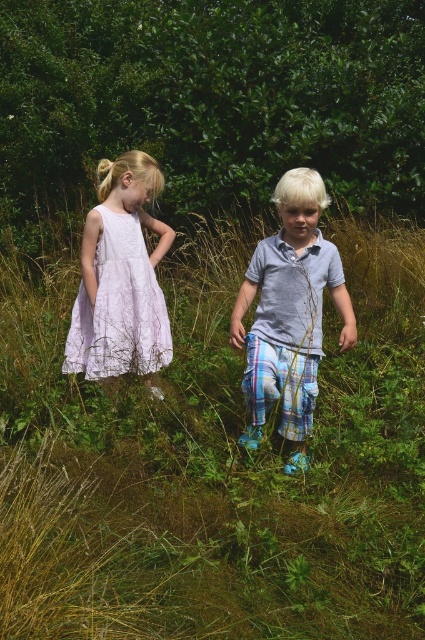
Is light blue plaid pants at center further to the viewer compared to lavender lace dress at left?

No.

Who is positioned more to the left, light blue plaid pants at center or lavender lace dress at left?

Positioned to the left is lavender lace dress at left.

Is point (282, 365) positioned in front of point (155, 296)?

Yes.

You are a GUI agent. You are given a task and a screenshot of the screen. Output one action in this format:
    pyautogui.click(x=<x>, y=<y>)
    Task: Click on the light blue plaid pants at center
    
    Given the screenshot: What is the action you would take?
    pyautogui.click(x=289, y=314)

Does green grassy at center have a lesser width compared to light blue plaid pants at center?

No, green grassy at center is not thinner than light blue plaid pants at center.

Who is more forward, (357, 442) or (320, 182)?

Point (320, 182) is in front.

The image size is (425, 640). I want to click on green grassy at center, so click(215, 464).

Which of these two, green grassy at center or lavender lace dress at left, stands taller?

green grassy at center

Looking at this image, which of these two, green grassy at center or lavender lace dress at left, stands shorter?

Standing shorter between the two is lavender lace dress at left.

Which is behind, point (416, 419) or point (146, 273)?

The point (146, 273) is behind.

At what (x,y) coordinates should I click in order to perform the action: click on green grassy at center. Please return your answer as a coordinate pair (x, y). Looking at the image, I should click on (215, 464).